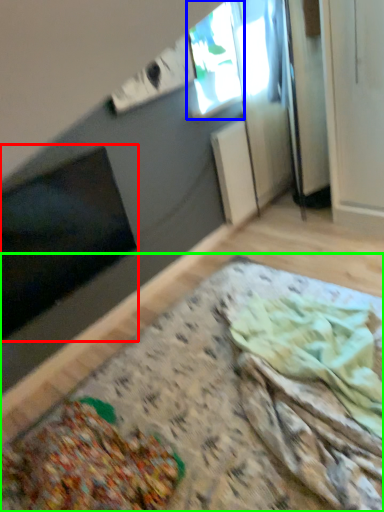
Question: Based on their relative distances, which object is nearer to window screen (highlighted by a red box)? Choose from window (highlighted by a blue box) and table (highlighted by a green box).

Choices:
 (A) window
 (B) table

Answer: (B)